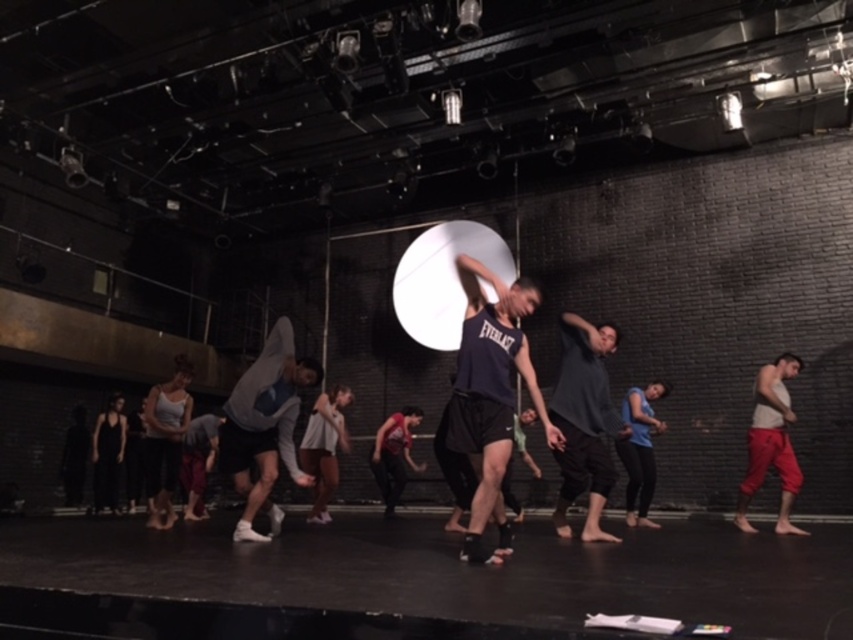
You are a photographer setting up a camera on the stage. You need to focus on both the gray cotton shirt at center and the white cotton tank top at right. Which of these two should you adjust your camera focus to first if you want to ensure both are in focus?

The gray cotton shirt at center is wider than the white cotton tank top at right, so you should focus on the wider object first to ensure depth of field covers both.

You are a photographer positioned at the back of the stage. You want to capture a closeup shot of the navy blue athletic tank top at center. Given that your camera has a focal length of 100mm, will the point at coordinates point (491, 397) be within the frame?

The point at coordinates point (491, 397) corresponds to the navy blue athletic tank top at center, so yes, it will be within the frame as the photographer aims for it.